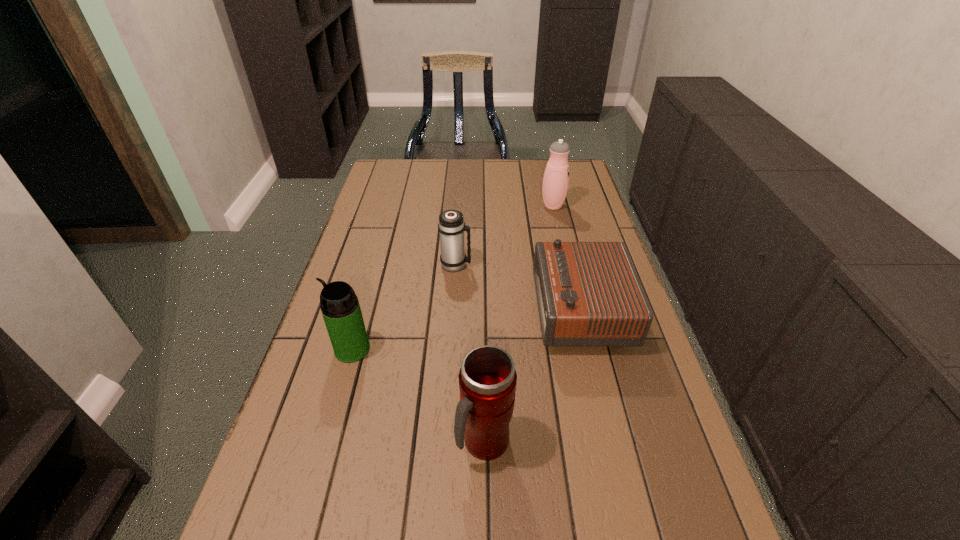
Locate an element on the screen. The width and height of the screenshot is (960, 540). object that stands as the third closest to the leftmost thermos bottle is located at coordinates (588, 293).

Identify the location of thermos bottle that is the closest one to the nearest object. The image size is (960, 540). (341, 311).

Where is `thermos bottle object that ranks as the third closest to the leftmost object`? The image size is (960, 540). thermos bottle object that ranks as the third closest to the leftmost object is located at coordinates (555, 184).

Image resolution: width=960 pixels, height=540 pixels. Identify the location of free space that satisfies the following two spatial constraints: 1. on the front panel of the radio receiver; 2. on the side with the handle of the nearest thermos bottle. point(612,442).

You are a GUI agent. You are given a task and a screenshot of the screen. Output one action in this format:
    pyautogui.click(x=<x>, y=<y>)
    Task: Click on the free space that satisfies the following two spatial constraints: 1. on the front panel of the radio receiver; 2. on the side with the handle of the nearest object
    The width and height of the screenshot is (960, 540).
    Given the screenshot: What is the action you would take?
    pyautogui.click(x=612, y=442)

The image size is (960, 540). In order to click on free space that satisfies the following two spatial constraints: 1. on the front side of the farthest object; 2. on the side with the handle of the second farthest object in this screenshot , I will do `click(566, 265)`.